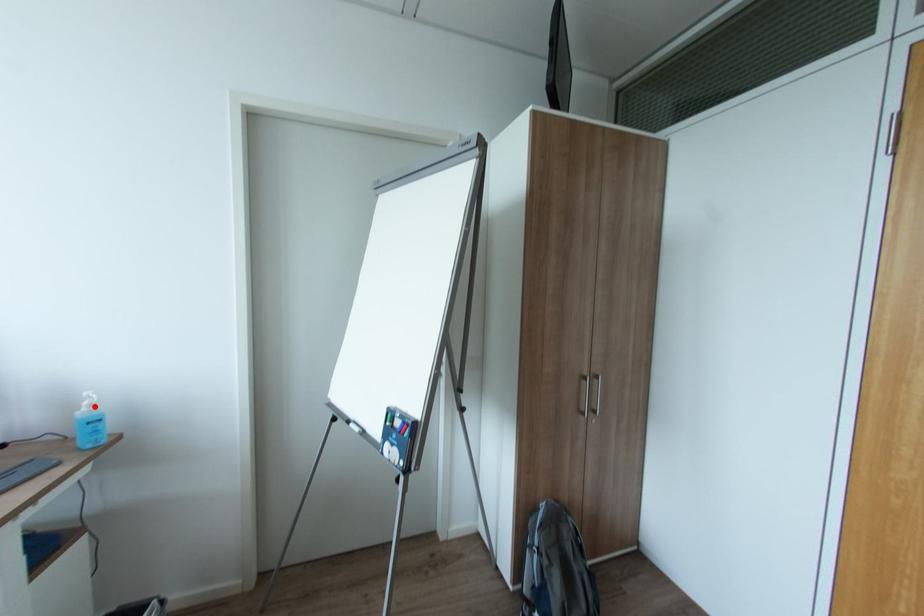
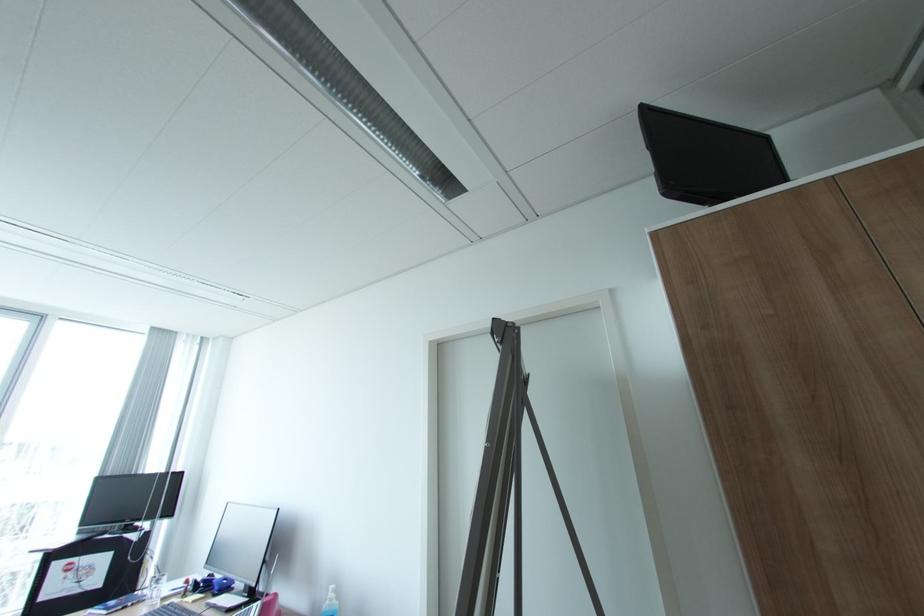
Find the pixel in the second image that matches the highlighted location in the first image.

(336, 599)